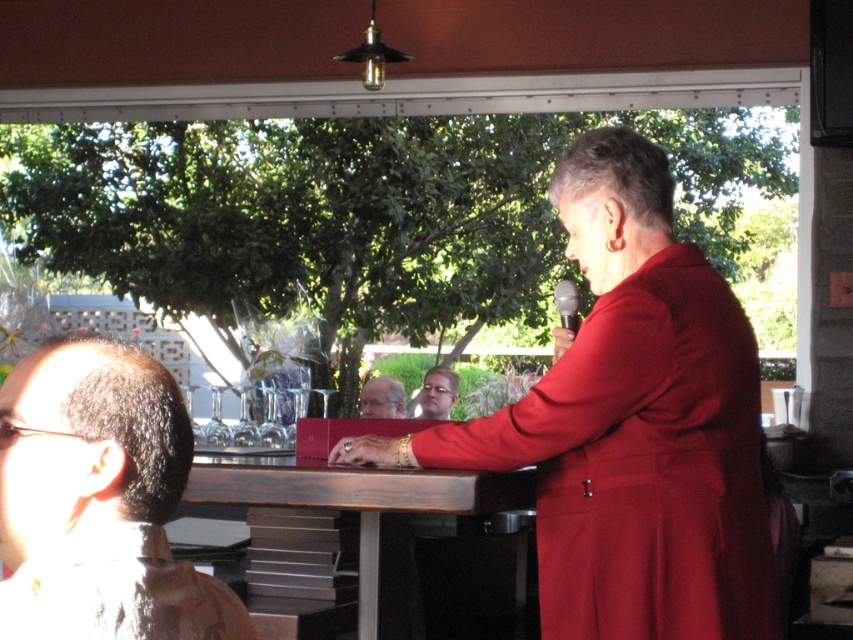
You are a photographer setting up for an event. You need to position a camera so that both the matte red coat at center and the matte plastic glasses at center are in frame. Considering their sizes, which object should be placed closer to the camera to ensure both fit in the shot?

Since the matte red coat at center might be wider than matte plastic glasses at center, to ensure both fit in the shot, the matte red coat at center should be placed closer to the camera. This way, its larger size can be accommodated within the frame while the smaller matte plastic glasses at center remain in view.

You are standing in the outdoor setting where the woman in red is speaking. There is a point labeled at coordinates (97, 500). What is located at that point?

The point at coordinates (97, 500) indicates brown hair at left.

You are organizing a small event and need to ensure that the matte red coat at center and the matte plastic glasses at center can fit on a shelf. The shelf has a width of 1 meter. Given their sizes, will both items fit side by side?

The matte red coat at center is larger in size than the matte plastic glasses at center. However, without specific measurements, it is impossible to determine if both items will fit on a 1 meter shelf. Additional information about their exact dimensions is required.